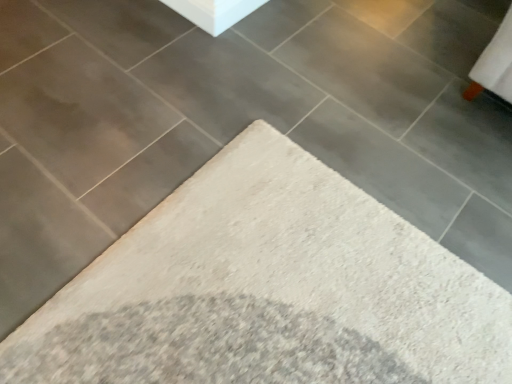
Find the location of a particular element. vacant area that is situated to the right of white smooth concrete at upper center is located at coordinates (282, 26).